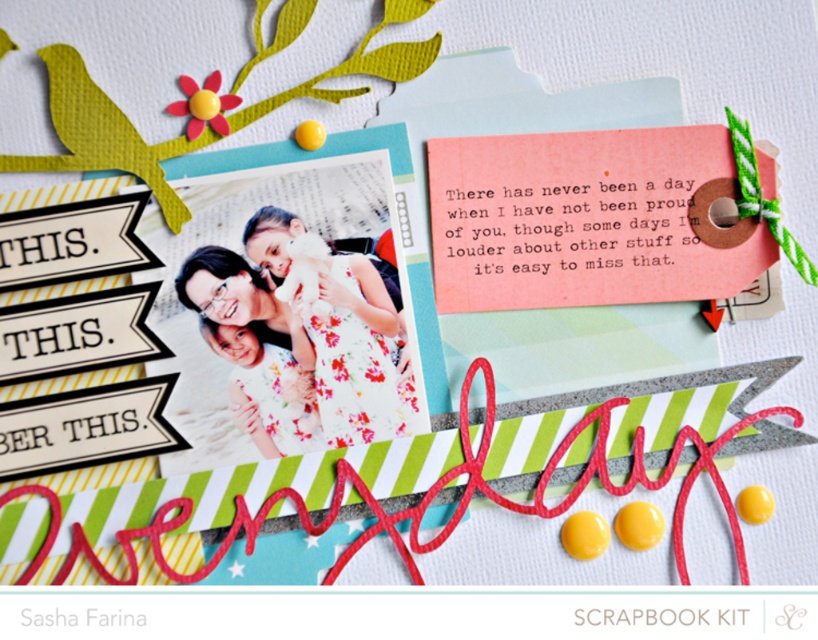
Question: Considering the relative positions of pink paper tag at upper right and floral fabric dress at center in the image provided, where is pink paper tag at upper right located with respect to floral fabric dress at center?

Choices:
 (A) left
 (B) right

Answer: (B)

Question: Among these objects, which one is nearest to the camera?

Choices:
 (A) floral fabric dress at center
 (B) pink paper tag at upper right

Answer: (A)

Question: Which object appears closest to the camera in this image?

Choices:
 (A) pink paper tag at upper right
 (B) floral fabric dress at center

Answer: (B)

Question: Is pink paper tag at upper right wider than floral fabric dress at center?

Choices:
 (A) no
 (B) yes

Answer: (B)

Question: Is pink paper tag at upper right to the right of floral fabric dress at center from the viewer's perspective?

Choices:
 (A) no
 (B) yes

Answer: (B)